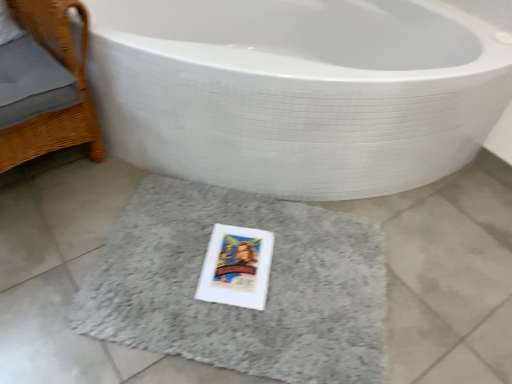
The image size is (512, 384). Find the location of `woven wood chair at left`. woven wood chair at left is located at coordinates (55, 111).

Can you tell me how much gray shaggy bath mat at center and woven wood chair at left differ in facing direction?

The angle between the facing direction of gray shaggy bath mat at center and the facing direction of woven wood chair at left is 49.6 degrees.

Is point (377, 283) positioned in front of point (83, 73)?

Yes, point (377, 283) is closer to viewer.

Considering the sizes of objects gray shaggy bath mat at center and woven wood chair at left in the image provided, who is thinner, gray shaggy bath mat at center or woven wood chair at left?

Thinner between the two is woven wood chair at left.

Based on the photo, can we say gray shaggy bath mat at center lies outside woven wood chair at left?

Absolutely, gray shaggy bath mat at center is external to woven wood chair at left.

Considering the points (450, 38) and (157, 269), which point is behind, point (450, 38) or point (157, 269)?

The point (450, 38) is behind.

Is white glossy bathtub at center further to camera compared to gray shaggy bath mat at center?

No, it is in front of gray shaggy bath mat at center.

The width and height of the screenshot is (512, 384). Find the location of `bath mat on the left of the white glossy bathtub at center`. bath mat on the left of the white glossy bathtub at center is located at coordinates (239, 307).

In the scene shown: From the image's perspective, is white glossy bathtub at center above gray shaggy bath mat at center?

Yes.

Considering the sizes of objects woven wood chair at left and white glossy bathtub at center in the image provided, who is thinner, woven wood chair at left or white glossy bathtub at center?

woven wood chair at left is thinner.

From the image's perspective, relative to white glossy bathtub at center, is woven wood chair at left above or below?

woven wood chair at left is below white glossy bathtub at center.

Which of these two, woven wood chair at left or white glossy bathtub at center, is bigger?

white glossy bathtub at center.

From a real-world perspective, who is located lower, woven wood chair at left or white glossy bathtub at center?

white glossy bathtub at center.

From a real-world perspective, is white glossy bathtub at center below woven wood chair at left?

Yes, from a real-world perspective, white glossy bathtub at center is beneath woven wood chair at left.

Considering the relative sizes of white glossy bathtub at center and woven wood chair at left in the image provided, is white glossy bathtub at center wider than woven wood chair at left?

Correct, the width of white glossy bathtub at center exceeds that of woven wood chair at left.

Identify the location of bathtub on the right of woven wood chair at left. (297, 91).

Is woven wood chair at left a part of white glossy bathtub at center?

No, woven wood chair at left is not a part of white glossy bathtub at center.

Is point (314, 216) positioned after point (403, 104)?

Yes, it is behind point (403, 104).

What's the angular difference between gray shaggy bath mat at center and white glossy bathtub at center's facing directions?

gray shaggy bath mat at center and white glossy bathtub at center are facing 48.9 degrees away from each other.

Considering the sizes of objects gray shaggy bath mat at center and white glossy bathtub at center in the image provided, who is smaller, gray shaggy bath mat at center or white glossy bathtub at center?

Result: gray shaggy bath mat at center.

Between gray shaggy bath mat at center and white glossy bathtub at center, which one has less height?

gray shaggy bath mat at center.

From the picture: From the image's perspective, is woven wood chair at left beneath gray shaggy bath mat at center?

No, from the image's perspective, woven wood chair at left is not below gray shaggy bath mat at center.

In the scene shown: Is woven wood chair at left bigger than gray shaggy bath mat at center?

Yes, woven wood chair at left is bigger than gray shaggy bath mat at center.

Is woven wood chair at left to the left or to the right of gray shaggy bath mat at center in the image?

From the image, it's evident that woven wood chair at left is to the left of gray shaggy bath mat at center.

Does woven wood chair at left touch gray shaggy bath mat at center?

woven wood chair at left and gray shaggy bath mat at center are not in contact.

Find the location of `furniture that is above the gray shaggy bath mat at center (from a real-world perspective)`. furniture that is above the gray shaggy bath mat at center (from a real-world perspective) is located at coordinates (55, 111).

What are the coordinates of `bathtub above the gray shaggy bath mat at center (from the image's perspective)` in the screenshot? It's located at (297, 91).

Considering their positions, is woven wood chair at left positioned closer to white glossy bathtub at center than gray shaggy bath mat at center?

gray shaggy bath mat at center is positioned closer to the anchor white glossy bathtub at center.

Based on their spatial positions, is gray shaggy bath mat at center or white glossy bathtub at center closer to woven wood chair at left?

Among the two, white glossy bathtub at center is located nearer to woven wood chair at left.

Considering their positions, is gray shaggy bath mat at center positioned further to white glossy bathtub at center than woven wood chair at left?

Among the two, woven wood chair at left is located further to white glossy bathtub at center.

Considering their positions, is white glossy bathtub at center positioned closer to woven wood chair at left than gray shaggy bath mat at center?

Based on the image, white glossy bathtub at center appears to be nearer to woven wood chair at left.

When comparing their distances from gray shaggy bath mat at center, does white glossy bathtub at center or woven wood chair at left seem closer?

The object closer to gray shaggy bath mat at center is white glossy bathtub at center.

Which object lies further to the anchor point gray shaggy bath mat at center, woven wood chair at left or white glossy bathtub at center?

woven wood chair at left is further to gray shaggy bath mat at center.

The width and height of the screenshot is (512, 384). In order to click on bath mat located between woven wood chair at left and white glossy bathtub at center in the left-right direction in this screenshot , I will do `click(239, 307)`.